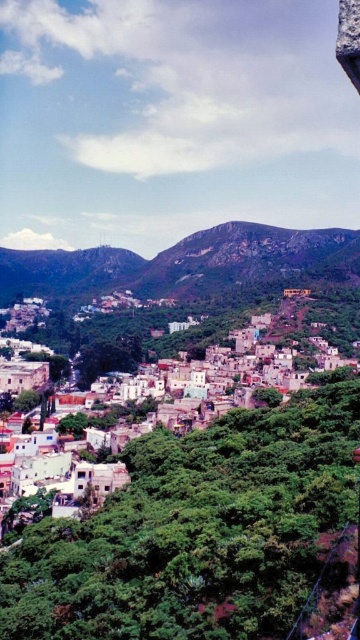
You are a drone operator tasked with capturing aerial footage of the green rocky mountain at center and the white matte buildings at lower left. Your drone has a limited battery life and can only focus on one subject at a time. Based on their sizes, which subject should you prioritize filming first to ensure the most impactful shot?

The green rocky mountain at center is larger in size than the white matte buildings at lower left, so you should prioritize filming the green rocky mountain at center first to capture its grandeur before the battery depletes.

You are a hiker standing at the starting point of a trail leading to the green rocky mountain at center. The trail is 300 meters long. Can you reach the mountain before the trail ends?

The green rocky mountain at center is 366.61 meters away from camera. Since the trail is only 300 meters long, you cannot reach the mountain before the trail ends because the distance to the mountain is greater than the trail length.

You are a delivery drone with a maximum flight range of 200 meters. You need to deliver a package to the white matte buildings at lower left from the green rocky mountain at center. Can you complete the delivery without needing to recharge?

The green rocky mountain at center and white matte buildings at lower left are 186.20 meters apart. Since the distance is within your 200 meter range, yes, you can complete the delivery without needing to recharge.